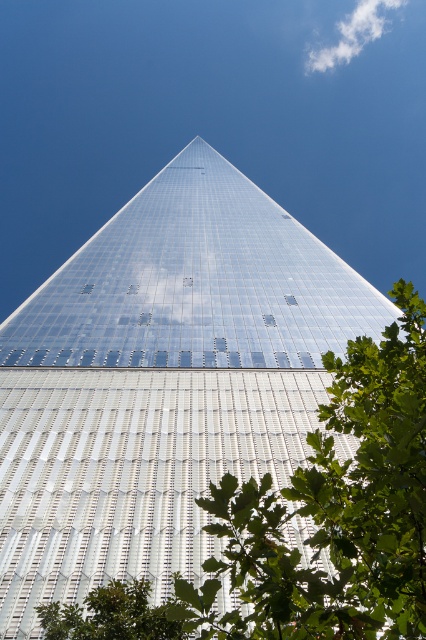
Can you confirm if green leafy tree at center is positioned to the left of green leafy tree at lower center?

No, green leafy tree at center is not to the left of green leafy tree at lower center.

Which is behind, point (382, 364) or point (109, 608)?

Positioned behind is point (109, 608).

Who is more forward, (367,637) or (131,602)?

Point (367,637) is in front.

This screenshot has height=640, width=426. What are the coordinates of `green leafy tree at center` in the screenshot? It's located at (334, 509).

Does green leafy tree at lower center appear on the right side of white fluffy cloud at upper center?

No, green leafy tree at lower center is not to the right of white fluffy cloud at upper center.

Does point (183, 608) lie behind point (379, 6)?

No, (183, 608) is in front of (379, 6).

Image resolution: width=426 pixels, height=640 pixels. Identify the location of green leafy tree at lower center. (112, 616).

Based on the photo, is green leafy tree at center closer to camera compared to white fluffy cloud at upper center?

Yes, it is in front of white fluffy cloud at upper center.

Is the position of green leafy tree at center more distant than that of white fluffy cloud at upper center?

No, green leafy tree at center is closer to the viewer.

Does point (264, 483) lie in front of point (348, 42)?

Yes, it is.

The width and height of the screenshot is (426, 640). I want to click on green leafy tree at center, so click(334, 509).